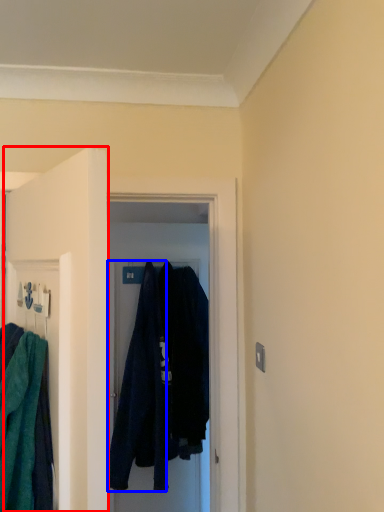
Question: Which object appears farthest to the camera in this image, door (highlighted by a red box) or robe (highlighted by a blue box)?

Choices:
 (A) door
 (B) robe

Answer: (B)